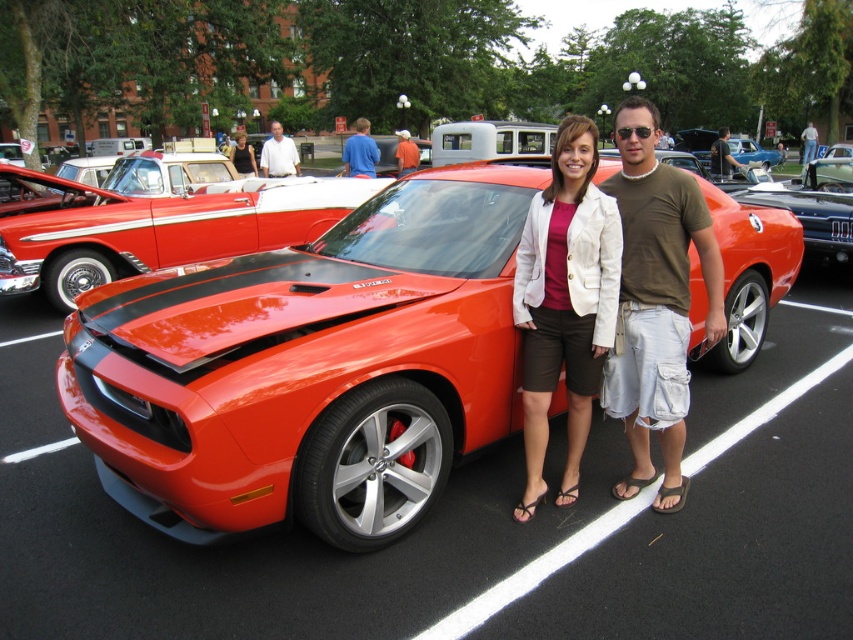
You are at the car show and want to take a photo of the glossy black car at center. Where should you position yourself to capture it in the frame?

Position yourself directly in front of the glossy black car at center, as it is located at coordinates point (828, 170).

You are a photographer at the car show and want to capture both the glossy black car at center and the matte orange shirt at center in a single frame. Considering their sizes, will you need to adjust your camera angle to ensure both fit?

The glossy black car at center might be wider than matte orange shirt at center, so adjusting the camera angle or position might be necessary to ensure both fit in the frame.

You are a photographer at the car show and need to capture a photo where both the shiny orange car at center and the dark brown leather jacket at center are visible. Based on their sizes, which object should you focus on first to ensure both fit in the frame?

The shiny orange car at center is smaller than the dark brown leather jacket at center. To ensure both fit in the frame, focus on positioning the camera so that the smaller shiny orange car at center is centered, allowing the larger dark brown leather jacket at center to naturally fit within the shot.